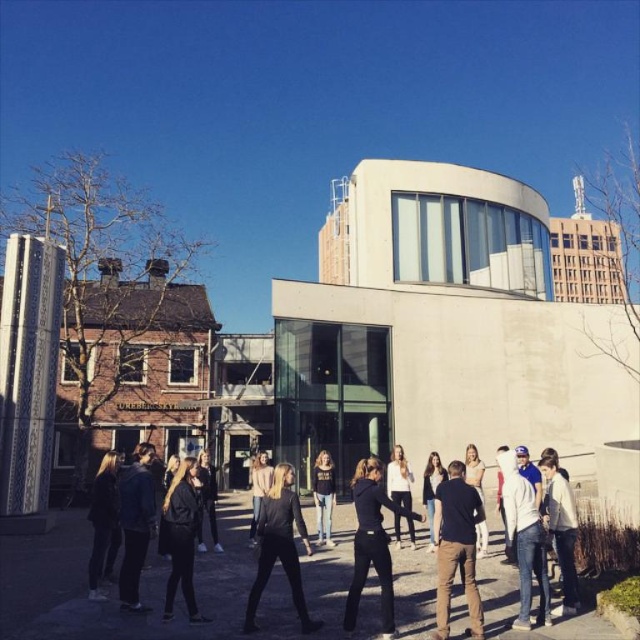
Is black matte shirt at center below black matte pants at center?

Actually, black matte shirt at center is above black matte pants at center.

Between black matte shirt at center and black matte pants at center, which one has less height?

Standing shorter between the two is black matte shirt at center.

Which is behind, point (436, 545) or point (381, 589)?

Positioned behind is point (436, 545).

Where is `black matte shirt at center`? black matte shirt at center is located at coordinates (456, 548).

Based on the photo, does denim pants at center have a lesser height compared to white matte shirt at center?

No, denim pants at center is not shorter than white matte shirt at center.

Can you confirm if denim pants at center is bigger than white matte shirt at center?

Yes.

The width and height of the screenshot is (640, 640). Identify the location of denim pants at center. (323, 496).

The width and height of the screenshot is (640, 640). Identify the location of denim pants at center. (323, 496).

From the picture: Does black matte shirt at center appear on the right side of denim pants at center?

Yes, black matte shirt at center is to the right of denim pants at center.

Does point (472, 513) lie in front of point (332, 477)?

Yes, point (472, 513) is closer to viewer.

What do you see at coordinates (456, 548) in the screenshot?
I see `black matte shirt at center` at bounding box center [456, 548].

Find the location of a particular element. This screenshot has height=640, width=640. black matte shirt at center is located at coordinates (456, 548).